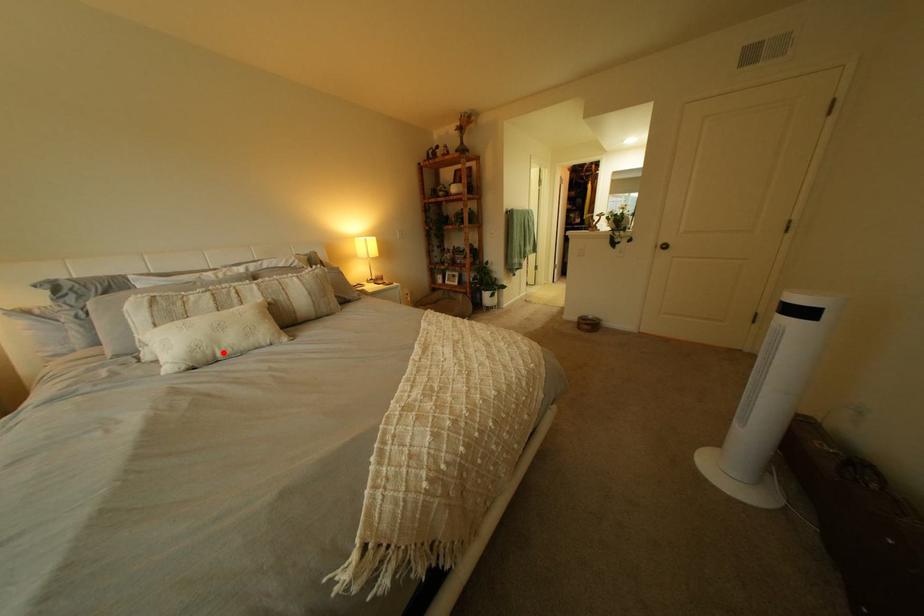
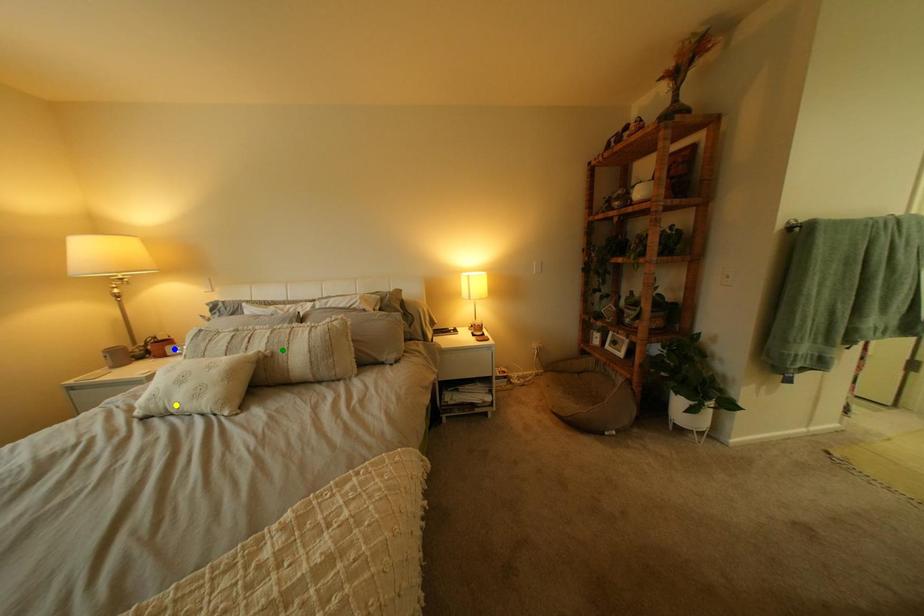
Question: I am providing you with two images of the same scene from different viewpoints. A red point is marked on the first image. You are given multiple points on the second image. Which point in image 2 represents the same 3d spot as the red point in image 1?

Choices:
 (A) blue point
 (B) yellow point
 (C) green point

Answer: (B)